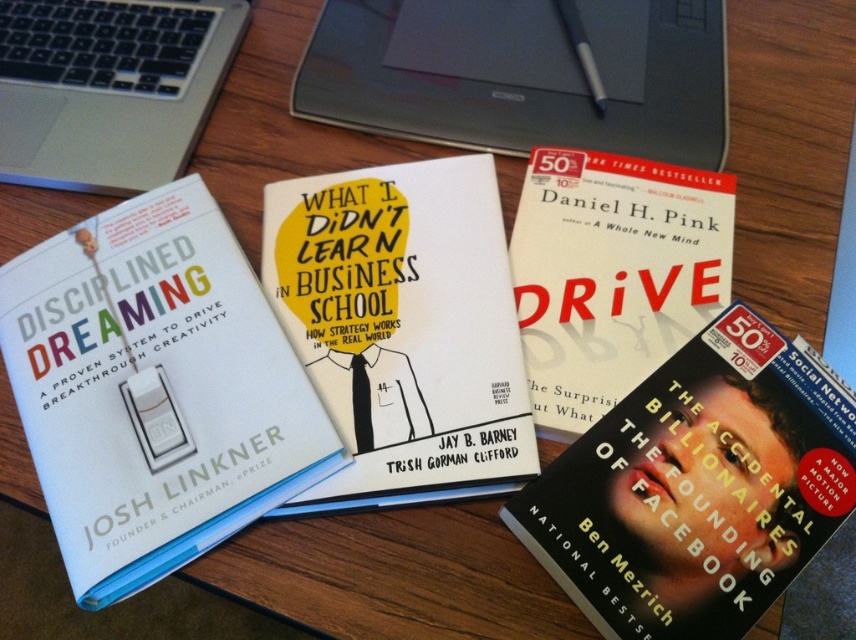
You are a photographer taking a closeup shot of the desk. You notice two points on the desk surface labeled as point A and point B. Point A is at coordinate point (586, 554) and point B is at coordinate point (343, 291). If you want to focus on the point that is closer to you, which point should you choose?

Point A at coordinate point (586, 554) is closer to the camera than point B at coordinate point (343, 291), so you should focus on point A.

You are a student trying to reach the hardcover book at center to take notes. The silver metallic laptop at upper center is blocking your view. Can you move the laptop to access the book?

The hardcover book at center is behind the silver metallic laptop at upper center, so you can move the laptop to access the book.